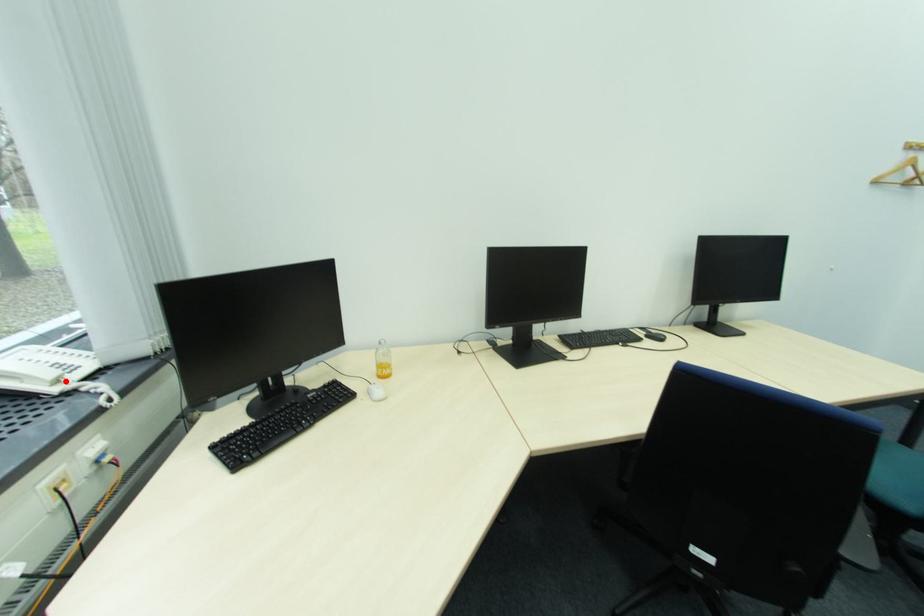
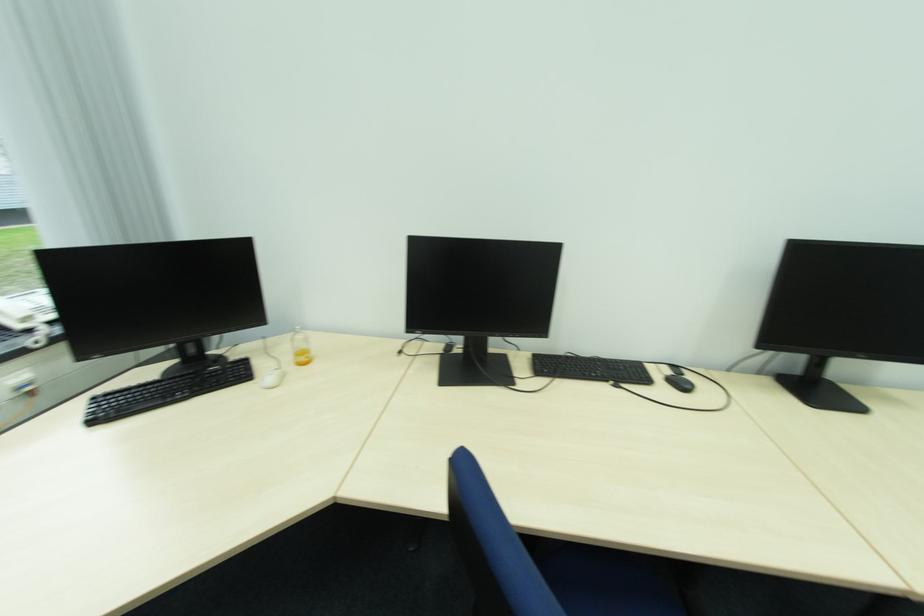
The point at the highlighted location is marked in the first image. Where is the corresponding point in the second image?

(31, 320)